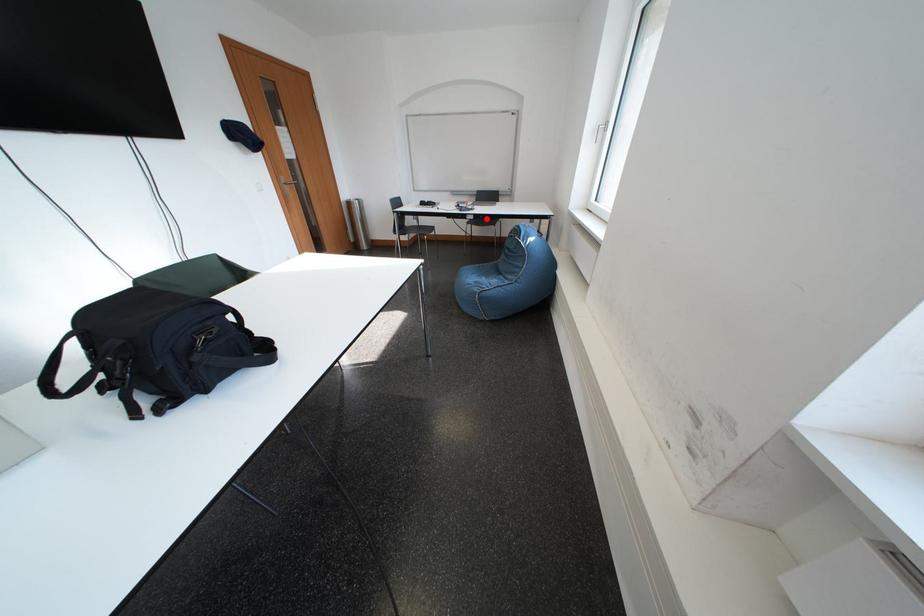
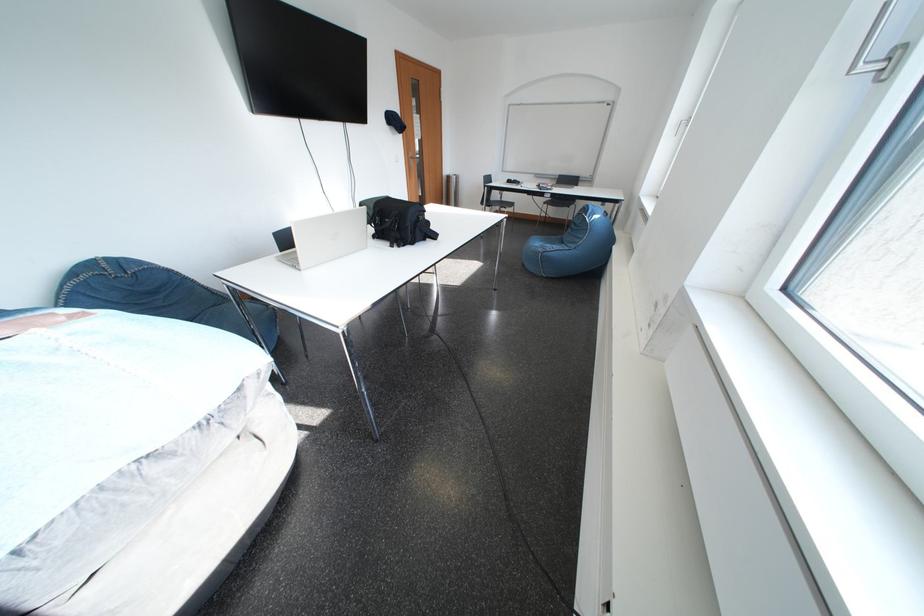
In the second image, find the point that corresponds to the highlighted location in the first image.

(563, 198)